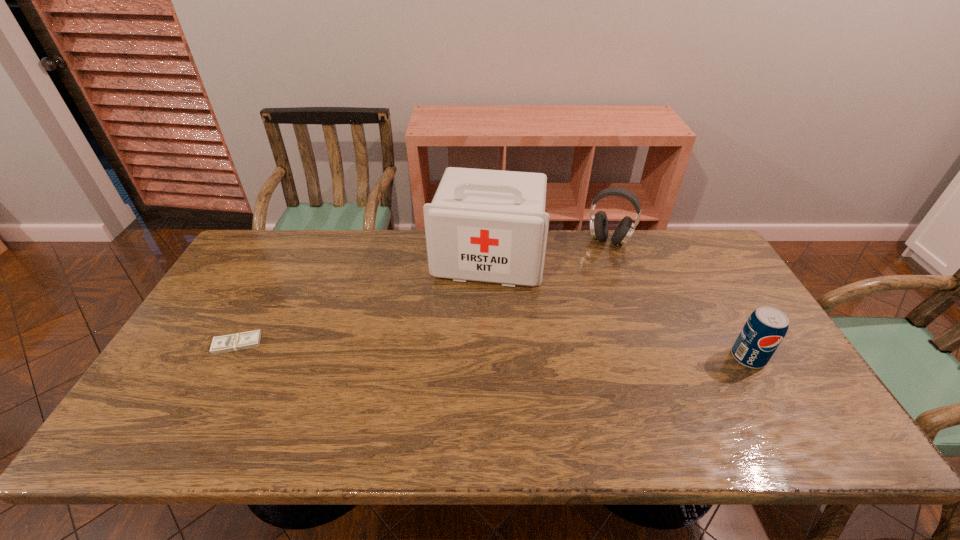
The height and width of the screenshot is (540, 960). Find the location of `free space at the far edge of the desktop`. free space at the far edge of the desktop is located at coordinates coord(300,238).

Image resolution: width=960 pixels, height=540 pixels. I want to click on free location at the near edge of the desktop, so click(396, 384).

Where is `vacant space at the left edge of the desktop`? vacant space at the left edge of the desktop is located at coordinates (176, 369).

This screenshot has width=960, height=540. I want to click on free space at the right edge of the desktop, so click(x=720, y=336).

Where is `vacant space at the far right corner of the desktop`? vacant space at the far right corner of the desktop is located at coordinates (697, 271).

Image resolution: width=960 pixels, height=540 pixels. What are the coordinates of `free spot at the near right corner of the desktop` in the screenshot? It's located at (804, 390).

This screenshot has width=960, height=540. In order to click on empty space between the shortest object and the rightmost object in this screenshot , I will do pyautogui.click(x=492, y=350).

Where is `vacant area that lies between the pop and the second tallest object`? vacant area that lies between the pop and the second tallest object is located at coordinates (679, 299).

Where is `vacant point located between the leftmost object and the third tallest object`? This screenshot has height=540, width=960. vacant point located between the leftmost object and the third tallest object is located at coordinates (492, 350).

Locate an element on the screen. The height and width of the screenshot is (540, 960). free space between the tallest object and the rightmost object is located at coordinates (618, 308).